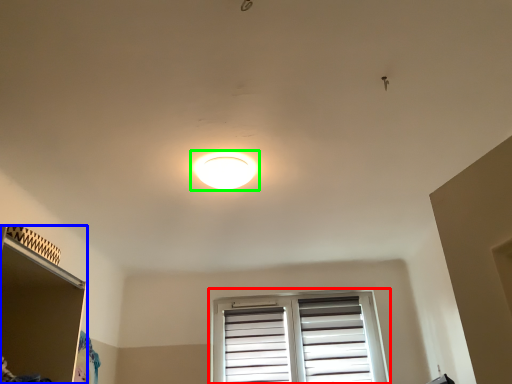
Question: Estimate the real-world distances between objects in this image. Which object is farther from window (highlighted by a red box), shelf (highlighted by a blue box) or lamp (highlighted by a green box)?

Choices:
 (A) shelf
 (B) lamp

Answer: (A)